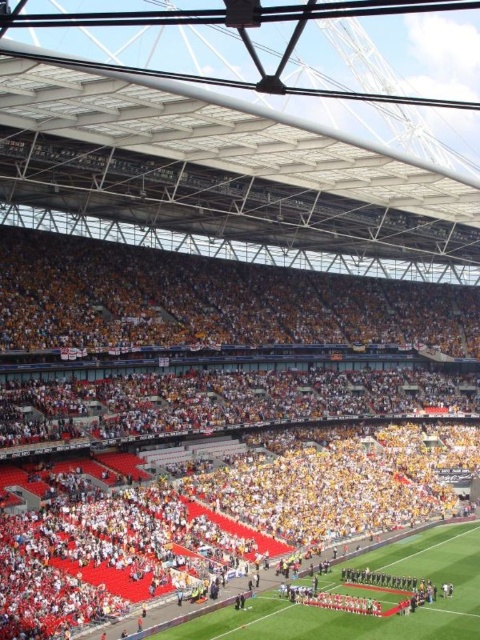
Question: Which of the following is the closest to the observer?

Choices:
 (A) green grass football field at center
 (B) yellow fabric seats at center

Answer: (B)

Question: Is yellow fabric seats at center to the right of green grass football field at center from the viewer's perspective?

Choices:
 (A) no
 (B) yes

Answer: (A)

Question: Which point appears farthest from the camera in this image?

Choices:
 (A) (450, 525)
 (B) (334, 378)

Answer: (B)

Question: Does yellow fabric seats at center have a larger size compared to green grass football field at center?

Choices:
 (A) yes
 (B) no

Answer: (A)

Question: Among these points, which one is nearest to the camera?

Choices:
 (A) (215, 566)
 (B) (243, 612)

Answer: (B)

Question: Is yellow fabric seats at center closer to the viewer compared to green grass football field at center?

Choices:
 (A) yes
 (B) no

Answer: (A)